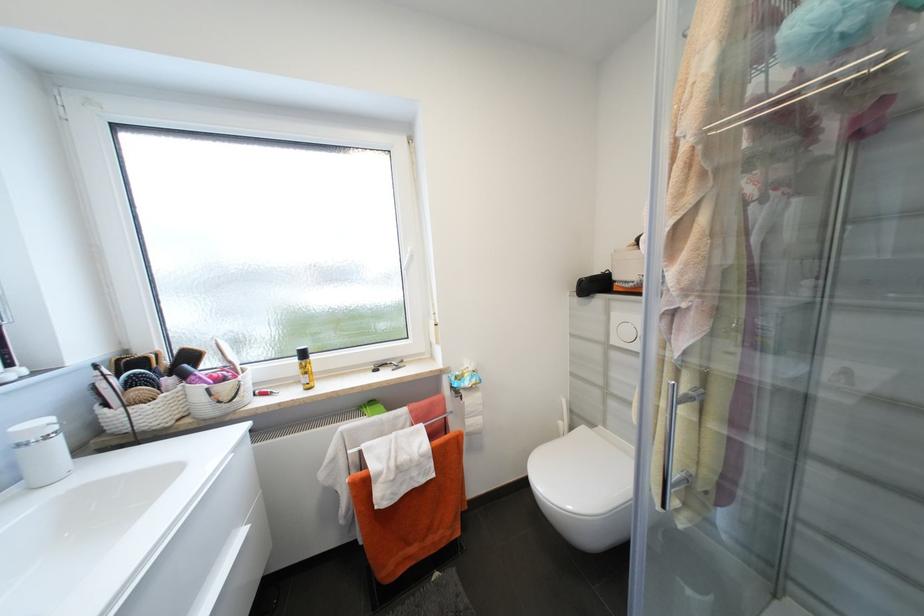
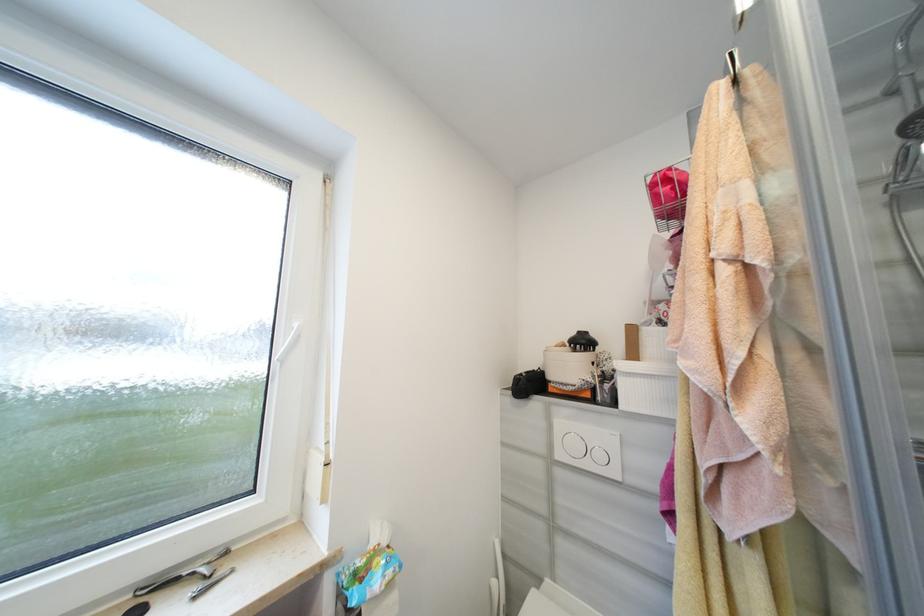
Looking at this image, how did the camera likely rotate?

The camera's rotation is toward right-up.